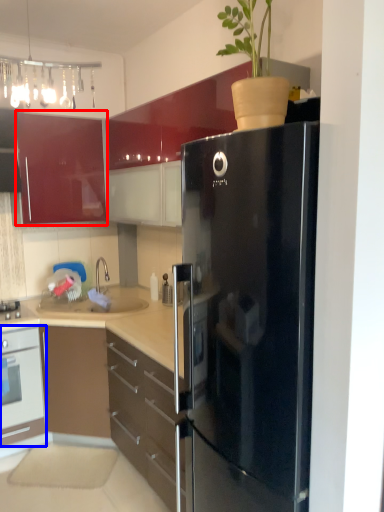
Question: Which object is further to the camera taking this photo, cabinetry (highlighted by a red box) or oven (highlighted by a blue box)?

Choices:
 (A) cabinetry
 (B) oven

Answer: (A)